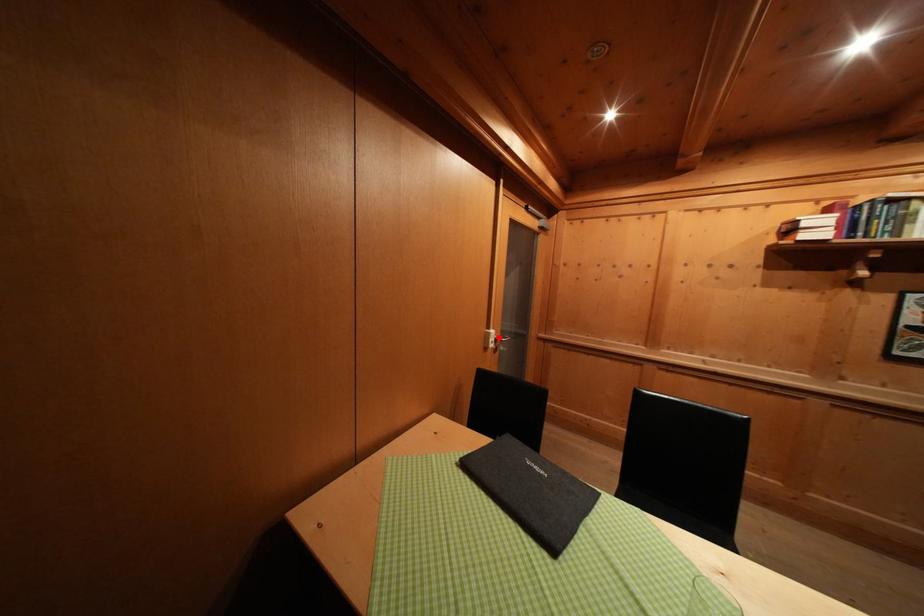
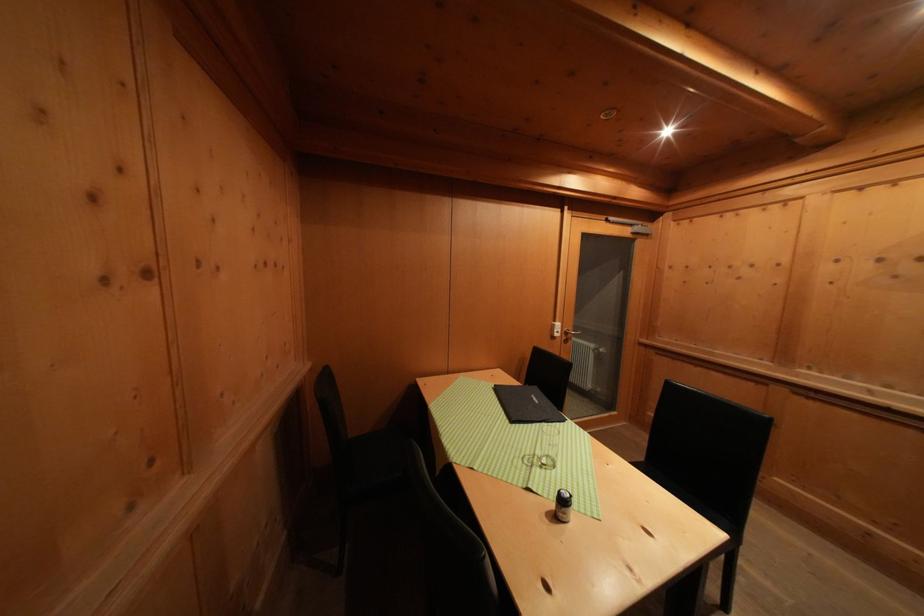
Question: I am providing you with two images of the same scene from different viewpoints. A red point is marked on the first image. Can you still see the location of the red point in image 2?

Choices:
 (A) Yes
 (B) No

Answer: (A)